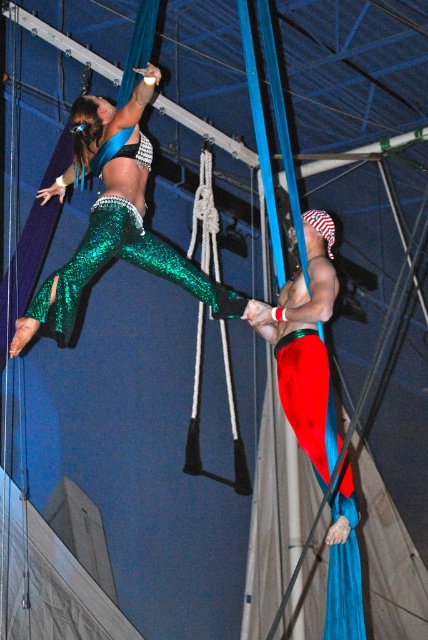
Question: Which point is closer to the camera?

Choices:
 (A) red fabric pants at center
 (B) shiny green sequined pants at center

Answer: (B)

Question: Where is shiny green sequined pants at center located in relation to red fabric pants at center in the image?

Choices:
 (A) right
 (B) left

Answer: (B)

Question: Which point is closer to the camera taking this photo?

Choices:
 (A) (174, 262)
 (B) (284, 388)

Answer: (A)

Question: Can you confirm if shiny green sequined pants at center is positioned to the left of red fabric pants at center?

Choices:
 (A) no
 (B) yes

Answer: (B)

Question: Can you confirm if shiny green sequined pants at center is thinner than red fabric pants at center?

Choices:
 (A) no
 (B) yes

Answer: (A)

Question: Which of the following is the farthest from the observer?

Choices:
 (A) (323, 250)
 (B) (35, 301)

Answer: (A)